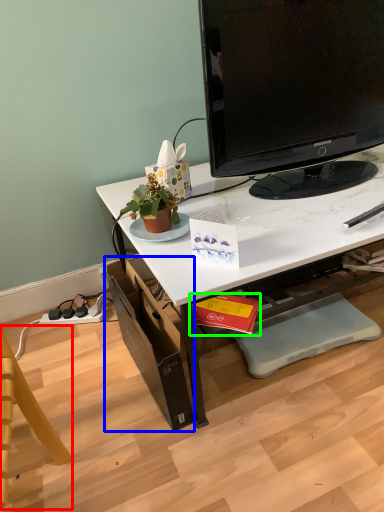
Question: Which object is the closest to the swivel chair (highlighted by a red box)? Choose among these: drawer (highlighted by a blue box) or book (highlighted by a green box).

Choices:
 (A) drawer
 (B) book

Answer: (A)